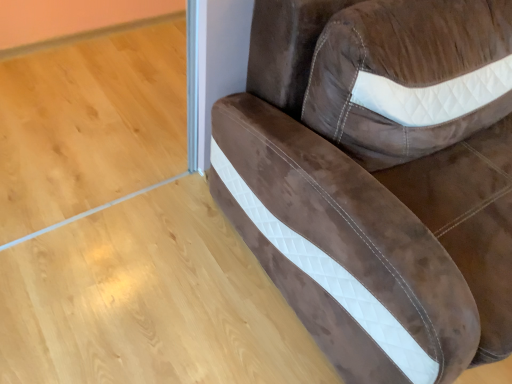
Measure the distance between brown leather chair at right and camera.

84.79 centimeters.

What do you see at coordinates (378, 180) in the screenshot? I see `brown leather chair at right` at bounding box center [378, 180].

Locate an element on the screen. brown leather chair at right is located at coordinates (378, 180).

I want to click on brown leather chair at right, so tap(378, 180).